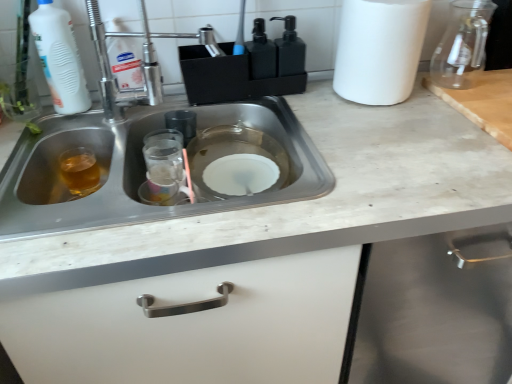
Question: Is transparent glass jar at upper right further to the viewer compared to black matte soap dispenser at upper center?

Choices:
 (A) no
 (B) yes

Answer: (A)

Question: Considering the relative sizes of transparent glass jar at upper right and black matte soap dispenser at upper center in the image provided, is transparent glass jar at upper right bigger than black matte soap dispenser at upper center?

Choices:
 (A) yes
 (B) no

Answer: (A)

Question: From the image's perspective, is transparent glass jar at upper right located above black matte soap dispenser at upper center?

Choices:
 (A) yes
 (B) no

Answer: (A)

Question: Is transparent glass jar at upper right aimed at black matte soap dispenser at upper center?

Choices:
 (A) no
 (B) yes

Answer: (A)

Question: Is transparent glass jar at upper right to the left of black matte soap dispenser at upper center from the viewer's perspective?

Choices:
 (A) no
 (B) yes

Answer: (A)

Question: Is transparent glass jar at upper right touching black matte soap dispenser at upper center?

Choices:
 (A) no
 (B) yes

Answer: (A)

Question: Does white matte paper towel at upper right have a smaller size compared to transparent glass jar at upper right?

Choices:
 (A) no
 (B) yes

Answer: (A)

Question: Does white matte paper towel at upper right appear on the right side of transparent glass jar at upper right?

Choices:
 (A) yes
 (B) no

Answer: (B)

Question: Is white matte paper towel at upper right facing towards transparent glass jar at upper right?

Choices:
 (A) yes
 (B) no

Answer: (B)

Question: Is white matte paper towel at upper right taller than transparent glass jar at upper right?

Choices:
 (A) yes
 (B) no

Answer: (A)

Question: Is white matte paper towel at upper right positioned far away from transparent glass jar at upper right?

Choices:
 (A) yes
 (B) no

Answer: (B)

Question: From the image's perspective, is white matte paper towel at upper right located above transparent glass jar at upper right?

Choices:
 (A) yes
 (B) no

Answer: (B)

Question: Considering the relative positions of transparent glass jar at upper right and white matte paper towel at upper right in the image provided, is transparent glass jar at upper right to the left of white matte paper towel at upper right from the viewer's perspective?

Choices:
 (A) yes
 (B) no

Answer: (B)